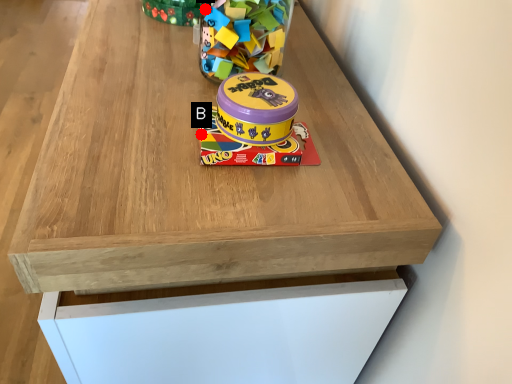
Question: Two points are circled on the image, labeled by A and B beside each circle. Which of the following is the farthest from the observer?

Choices:
 (A) A is further
 (B) B is further

Answer: (A)